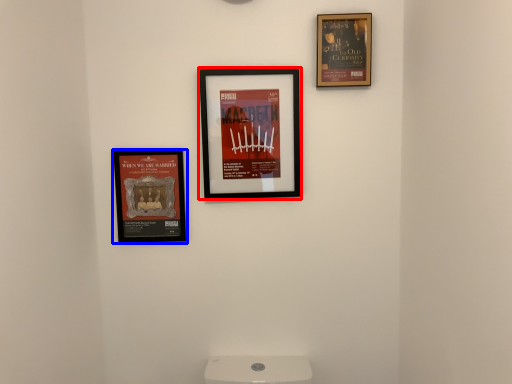
Question: Which point is closer to the camera, picture frame (highlighted by a red box) or picture frame (highlighted by a blue box)?

Choices:
 (A) picture frame
 (B) picture frame

Answer: (A)